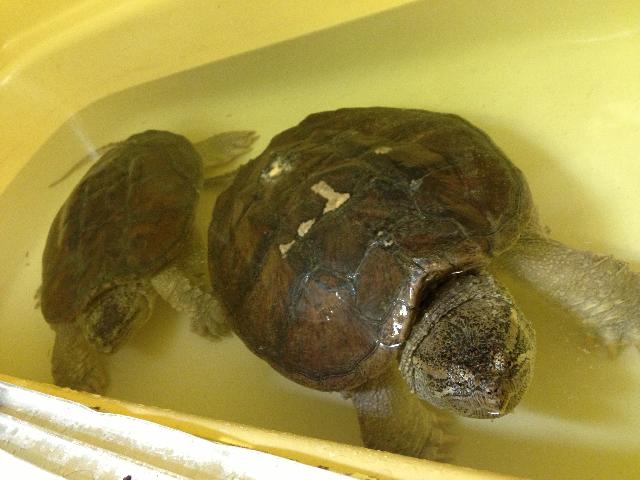
Where is `right front leg`? The width and height of the screenshot is (640, 480). right front leg is located at coordinates (396, 419), (79, 384).